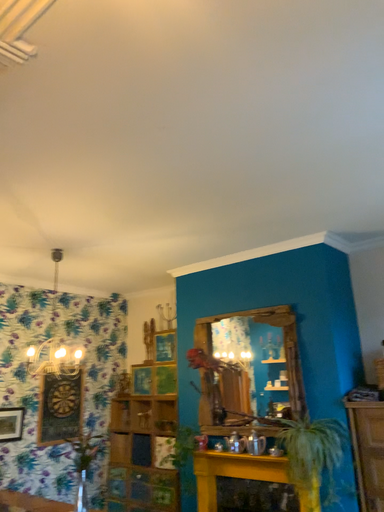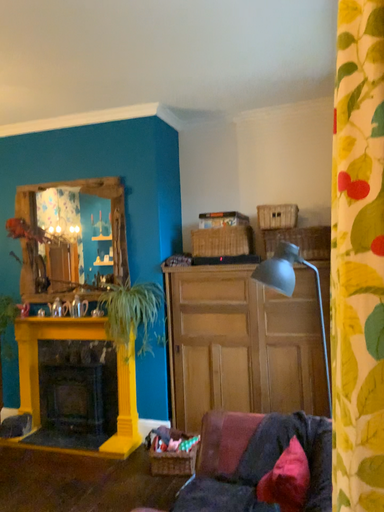
Question: Which way did the camera rotate in the video?

Choices:
 (A) rotated right
 (B) rotated left

Answer: (A)